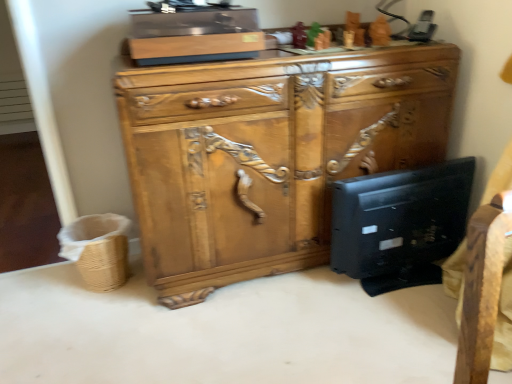
You are a GUI agent. You are given a task and a screenshot of the screen. Output one action in this format:
    pyautogui.click(x=<x>, y=<y>)
    Task: Click on the free location in front of wooden carved cabinet at center
    
    Given the screenshot: What is the action you would take?
    pyautogui.click(x=291, y=329)